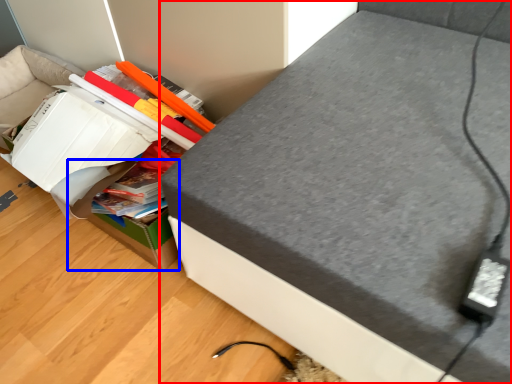
Question: Which object is closer to the camera taking this photo, furniture (highlighted by a red box) or cardboard box (highlighted by a blue box)?

Choices:
 (A) furniture
 (B) cardboard box

Answer: (A)